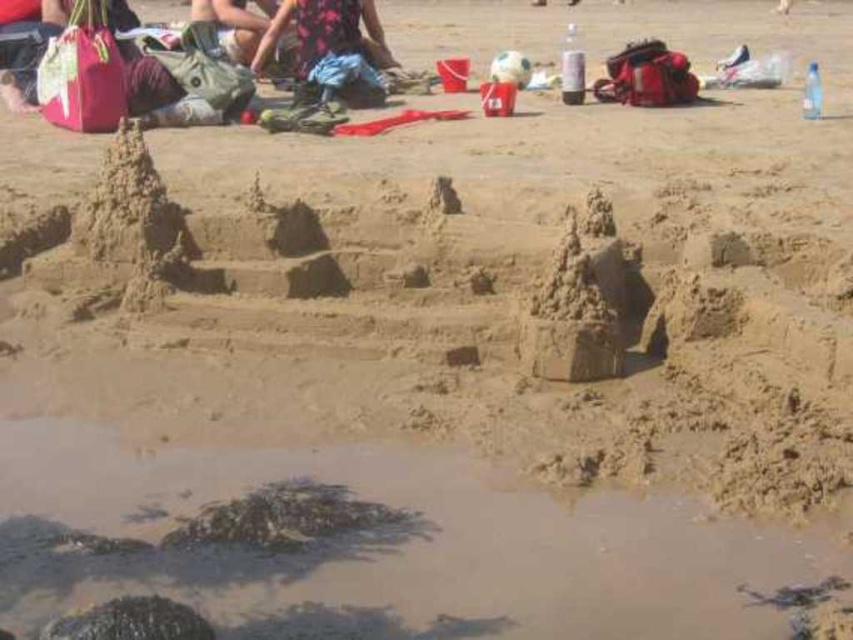
Question: Can you confirm if floral dress at center is positioned below green fabric bag at upper left?

Choices:
 (A) no
 (B) yes

Answer: (B)

Question: Does floral dress at center appear on the right side of green fabric bag at upper left?

Choices:
 (A) no
 (B) yes

Answer: (B)

Question: Which object appears farthest from the camera in this image?

Choices:
 (A) green fabric bag at upper left
 (B) floral dress at center

Answer: (A)

Question: Does floral dress at center appear under green fabric bag at upper left?

Choices:
 (A) no
 (B) yes

Answer: (B)

Question: Which object is farther from the camera taking this photo?

Choices:
 (A) green fabric bag at upper left
 (B) floral dress at center

Answer: (A)